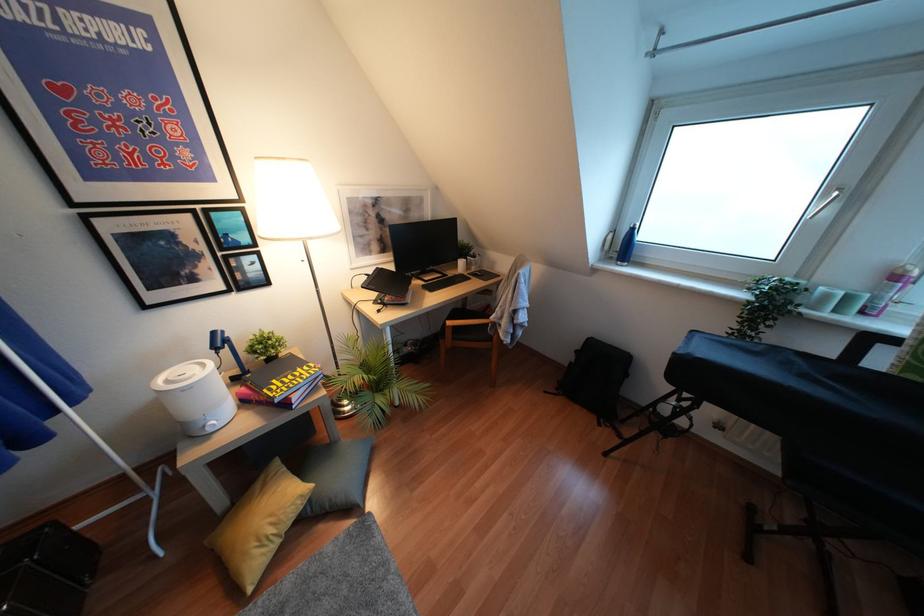
What do you see at coordinates (211, 426) in the screenshot? I see `the white humidifier knob` at bounding box center [211, 426].